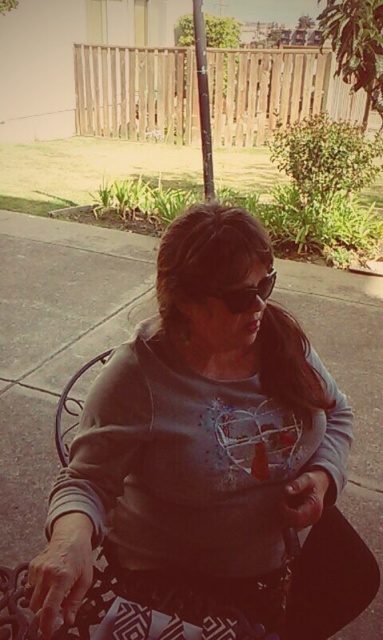
Question: Where is gray matte sweatshirt at center located in relation to matte black goggles at center in the image?

Choices:
 (A) left
 (B) right

Answer: (A)

Question: Which point appears farthest from the camera in this image?

Choices:
 (A) (235, 298)
 (B) (268, 502)

Answer: (B)

Question: Can you confirm if gray matte sweatshirt at center is positioned to the right of matte black goggles at center?

Choices:
 (A) yes
 (B) no

Answer: (B)

Question: Is gray matte sweatshirt at center wider than matte black goggles at center?

Choices:
 (A) no
 (B) yes

Answer: (B)